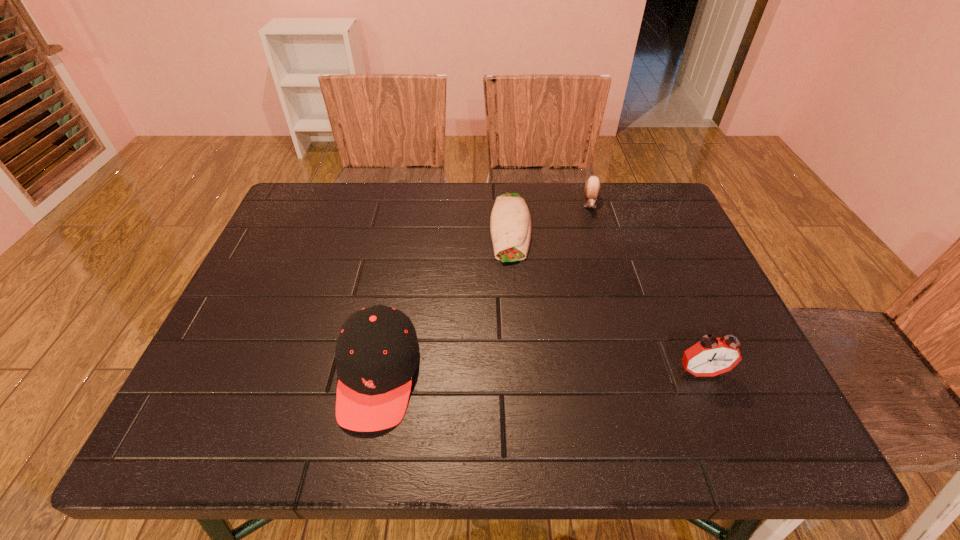
Identify the location of free spot on the desktop that is between the cap and the rightmost object and is positioned on the front-facing side of the escargot. (586, 373).

The image size is (960, 540). In order to click on free spot on the desktop that is between the leftmost object and the rightmost object and is positioned at the bitten end of the shortest object in this screenshot , I will do `click(512, 374)`.